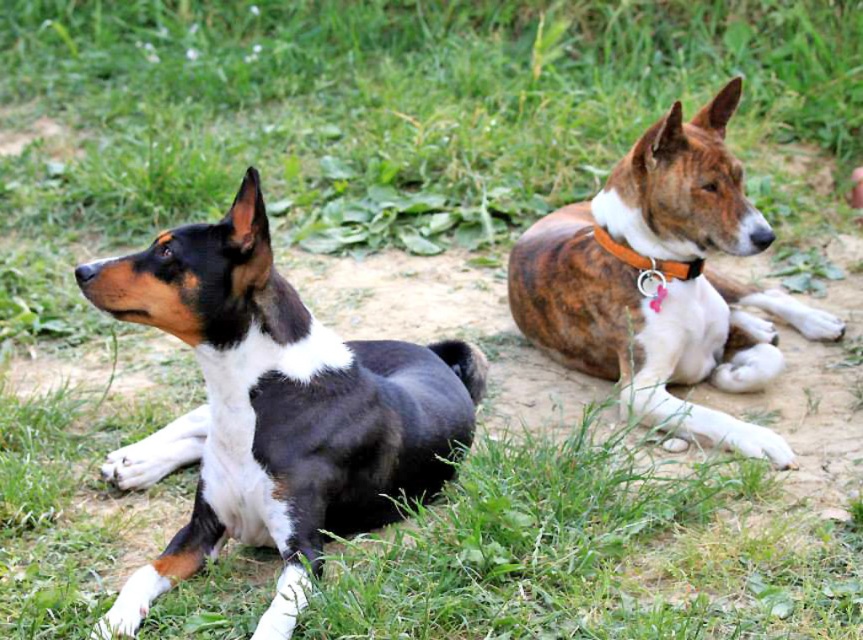
Between black and white fur dog at left and brown brindle dog at right, which one is positioned higher?

brown brindle dog at right is above.

Between black and white fur dog at left and brown brindle dog at right, which one appears on the left side from the viewer's perspective?

From the viewer's perspective, black and white fur dog at left appears more on the left side.

Image resolution: width=863 pixels, height=640 pixels. What are the coordinates of `black and white fur dog at left` in the screenshot? It's located at (275, 410).

In the scene shown: Can you confirm if brown brindle dog at right is bigger than orange fabric collar at upper right?

Correct, brown brindle dog at right is larger in size than orange fabric collar at upper right.

Which of these two, brown brindle dog at right or orange fabric collar at upper right, stands taller?

Standing taller between the two is brown brindle dog at right.

Identify the location of brown brindle dog at right. This screenshot has width=863, height=640. (662, 282).

Which is behind, point (230, 333) or point (666, 275)?

Point (666, 275)

Is black and white fur dog at left positioned behind orange fabric collar at upper right?

No, black and white fur dog at left is in front of orange fabric collar at upper right.

This screenshot has height=640, width=863. Identify the location of black and white fur dog at left. (275, 410).

Where is `black and white fur dog at left`? The image size is (863, 640). black and white fur dog at left is located at coordinates (275, 410).